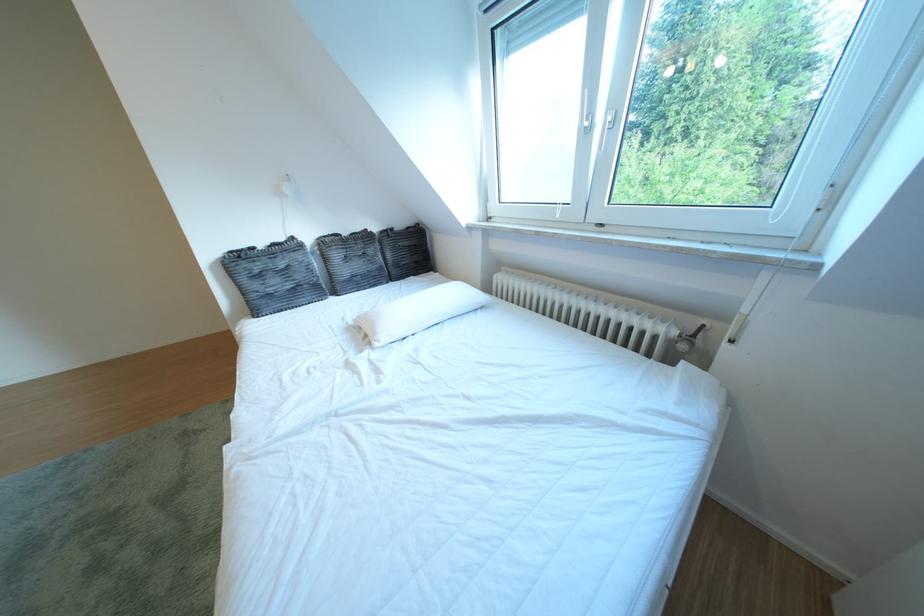
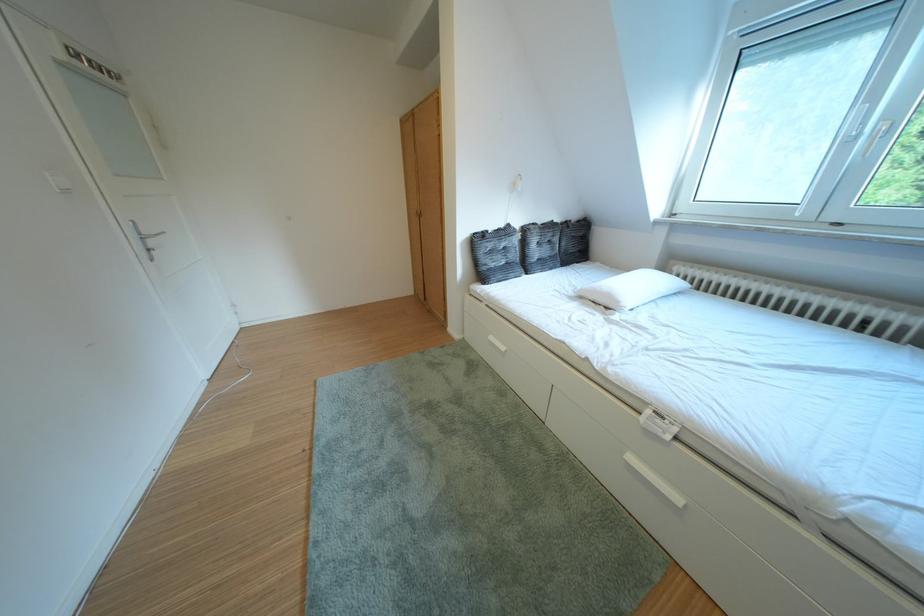
In the second image, find the point that corresponds to (414,229) in the first image.

(588, 222)